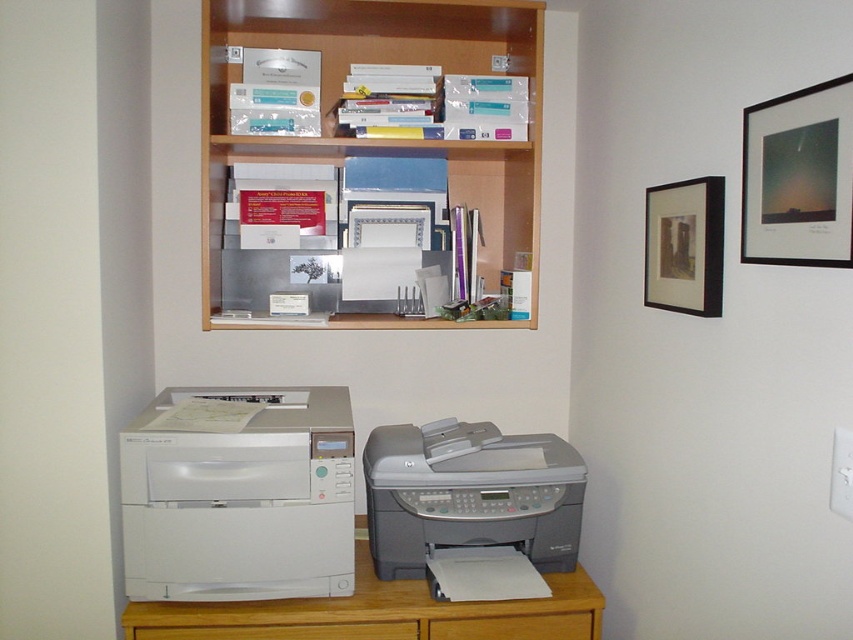
Question: Is white wood dresser at lower left above matte black picture frame at upper right?

Choices:
 (A) yes
 (B) no

Answer: (B)

Question: Which object appears closest to the camera in this image?

Choices:
 (A) black matte picture frame at upper right
 (B) gray matte printer at lower center
 (C) wooden bookshelf at upper center
 (D) white matte printer at lower left

Answer: (A)

Question: Is white wood dresser at lower left below black matte picture frame at upper right?

Choices:
 (A) no
 (B) yes

Answer: (B)

Question: Which point appears closest to the camera in this image?

Choices:
 (A) tap(511, 444)
 (B) tap(135, 636)

Answer: (B)

Question: Where is wooden bookshelf at upper center located in relation to gray matte printer at lower center in the image?

Choices:
 (A) left
 (B) right

Answer: (A)

Question: Which object is farther from the camera taking this photo?

Choices:
 (A) wooden bookshelf at upper center
 (B) black matte picture frame at upper right
 (C) wooden drawer at lower center

Answer: (A)